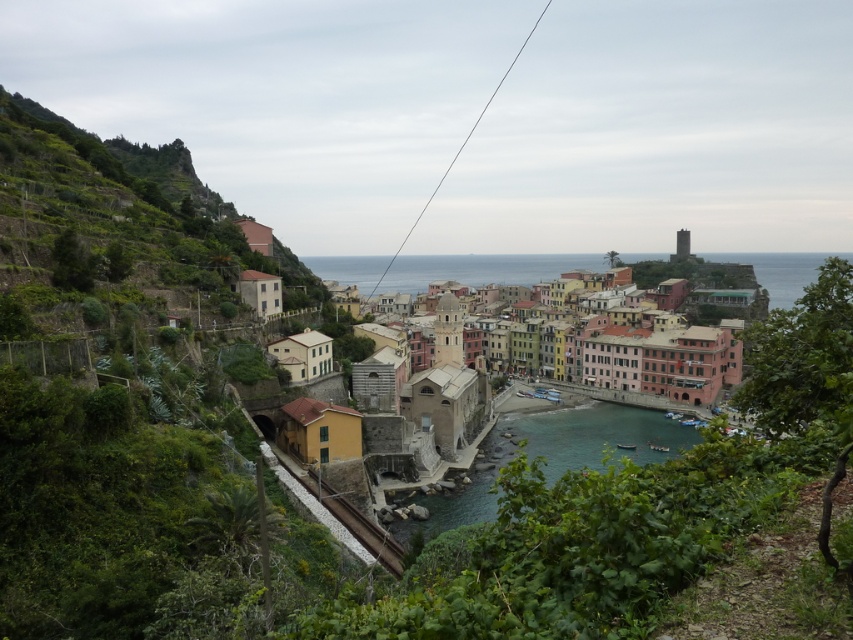
Question: Does clear blue water at center appear over multicolored painted buildings at center?

Choices:
 (A) no
 (B) yes

Answer: (A)

Question: Is clear blue water at center wider than multicolored painted buildings at center?

Choices:
 (A) yes
 (B) no

Answer: (B)

Question: Among these objects, which one is nearest to the camera?

Choices:
 (A) clear blue water at center
 (B) multicolored painted buildings at center

Answer: (A)

Question: Does clear blue water at center appear on the left side of multicolored painted buildings at center?

Choices:
 (A) no
 (B) yes

Answer: (B)